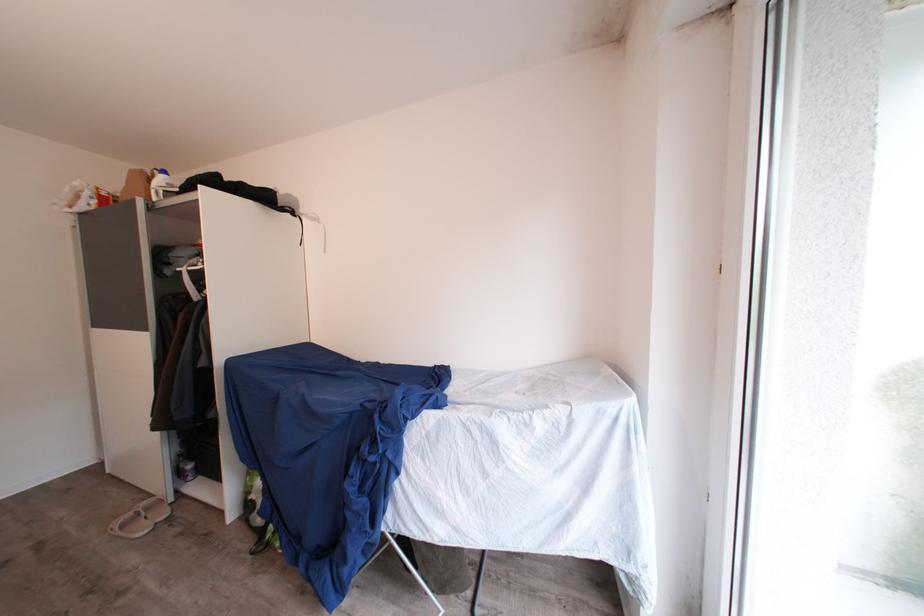
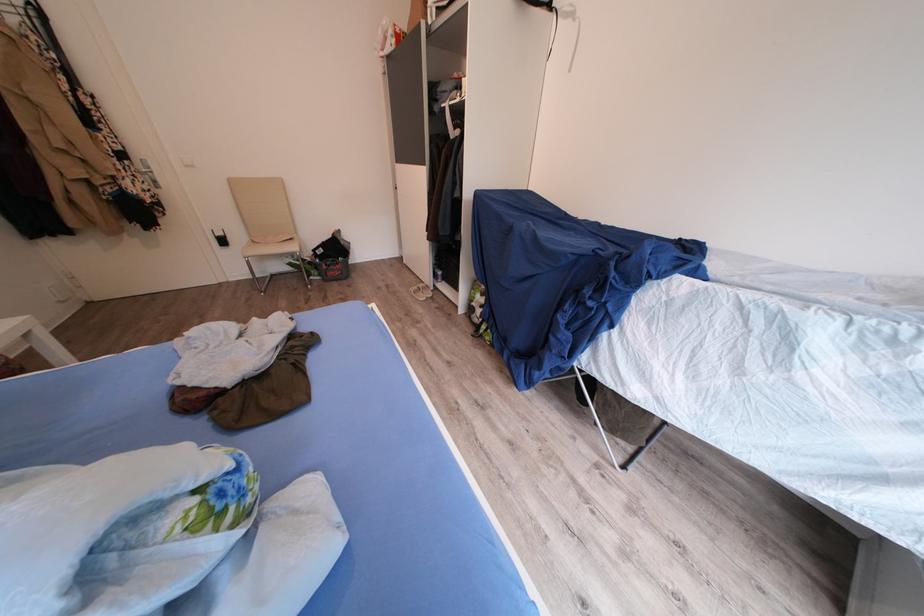
Find the pixel in the second image that matches point (138, 521) in the first image.

(424, 293)